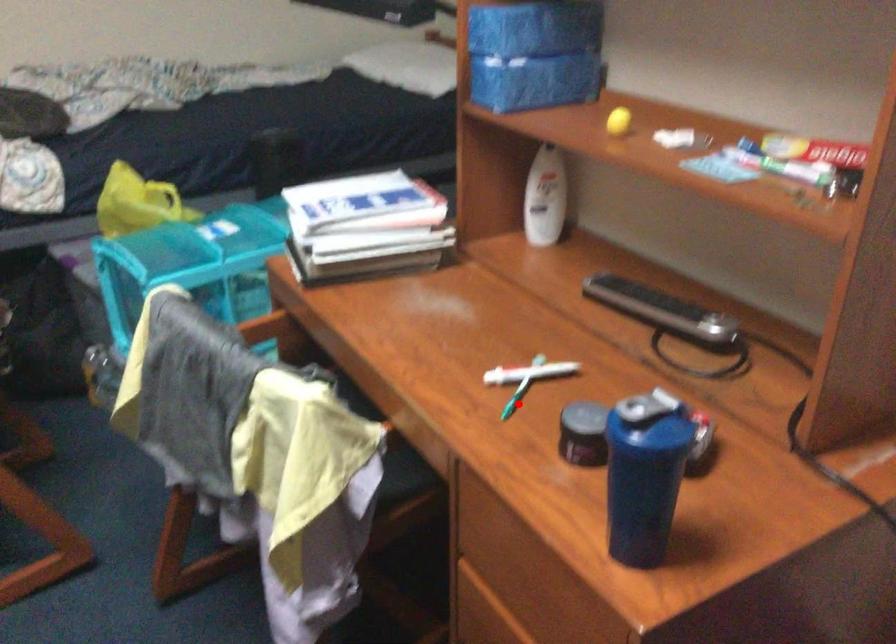
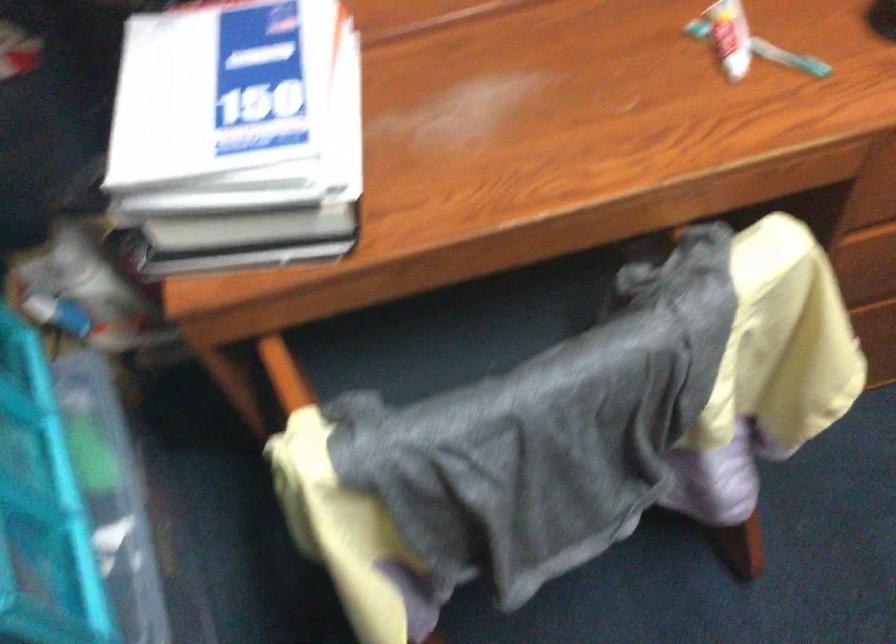
In the second image, find the point that corresponds to the highlighted location in the first image.

(789, 58)